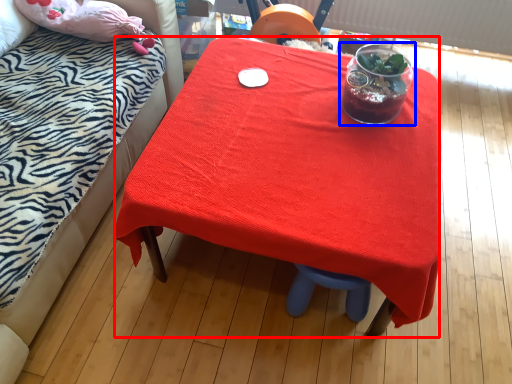
Question: Among these objects, which one is farthest to the camera, desk (highlighted by a red box) or tableware (highlighted by a blue box)?

Choices:
 (A) desk
 (B) tableware

Answer: (B)